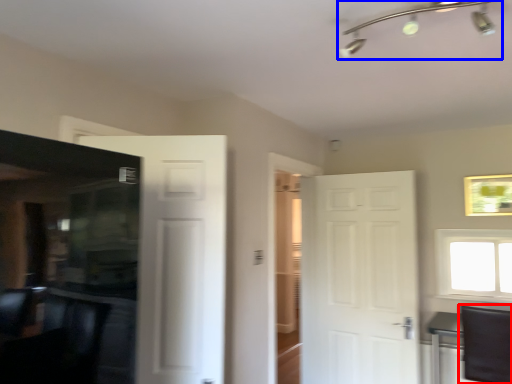
Question: Which of the following is the closest to the observer, swivel chair (highlighted by a red box) or light fixture (highlighted by a blue box)?

Choices:
 (A) swivel chair
 (B) light fixture

Answer: (B)